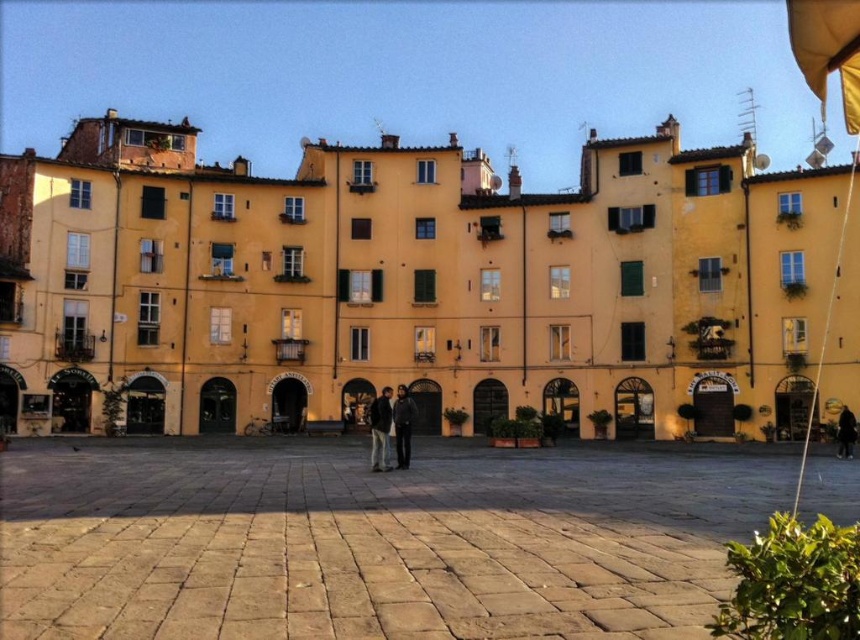
Measure the distance between yellow matte building at center and dark blue jeans at center.

yellow matte building at center is 20.90 meters from dark blue jeans at center.

Is yellow matte building at center to the right of dark blue jeans at center from the viewer's perspective?

No, yellow matte building at center is not to the right of dark blue jeans at center.

Who is more distant from viewer, (388,296) or (375,440)?

Positioned behind is point (388,296).

Where is `yellow matte building at center`? The height and width of the screenshot is (640, 860). yellow matte building at center is located at coordinates (421, 285).

Does yellow matte building at center have a lesser height compared to dark gray fabric jacket at center?

No.

Who is more distant from viewer, (336,220) or (387,468)?

The point (336,220) is behind.

Find the location of `yellow matte building at center`. yellow matte building at center is located at coordinates (421, 285).

Is point (263, 524) farther from camera compared to point (406, 396)?

No, (263, 524) is in front of (406, 396).

Does brown stone pavement at center appear on the right side of dark gray jacket at center?

Correct, you'll find brown stone pavement at center to the right of dark gray jacket at center.

This screenshot has height=640, width=860. Find the location of `brown stone pavement at center`. brown stone pavement at center is located at coordinates (372, 541).